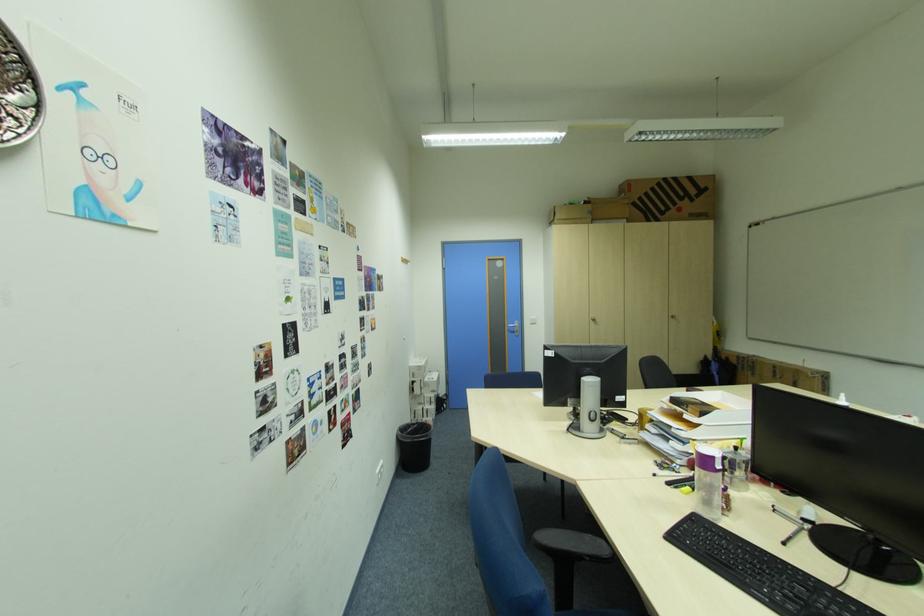
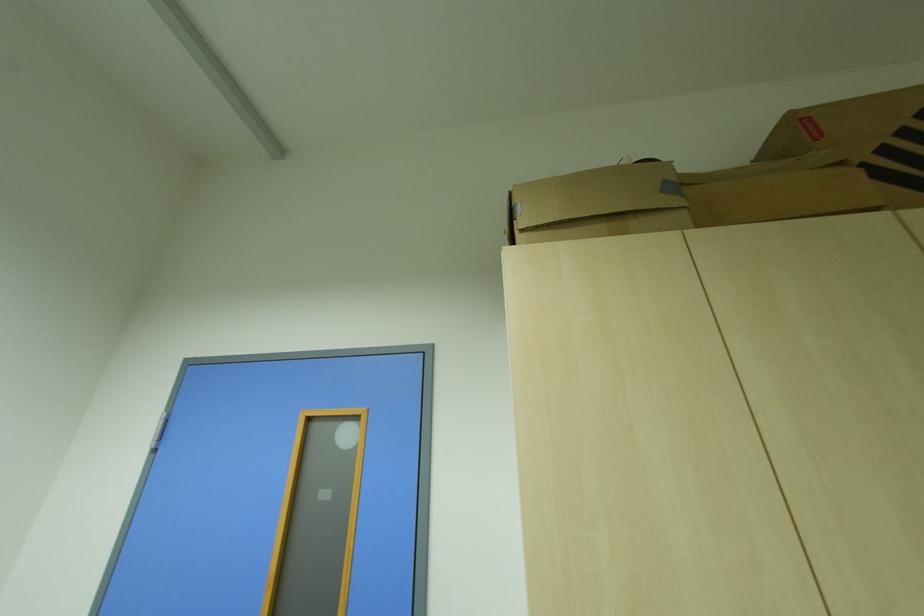
Where in the second image is the point corresponding to (563,208) from the first image?

(517, 195)